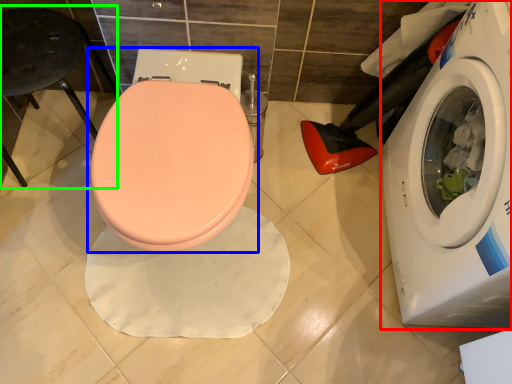
Question: Based on their relative distances, which object is farther from washing machine (highlighted by a red box)? Choose from toilet (highlighted by a blue box) and bar stool (highlighted by a green box).

Choices:
 (A) toilet
 (B) bar stool

Answer: (B)